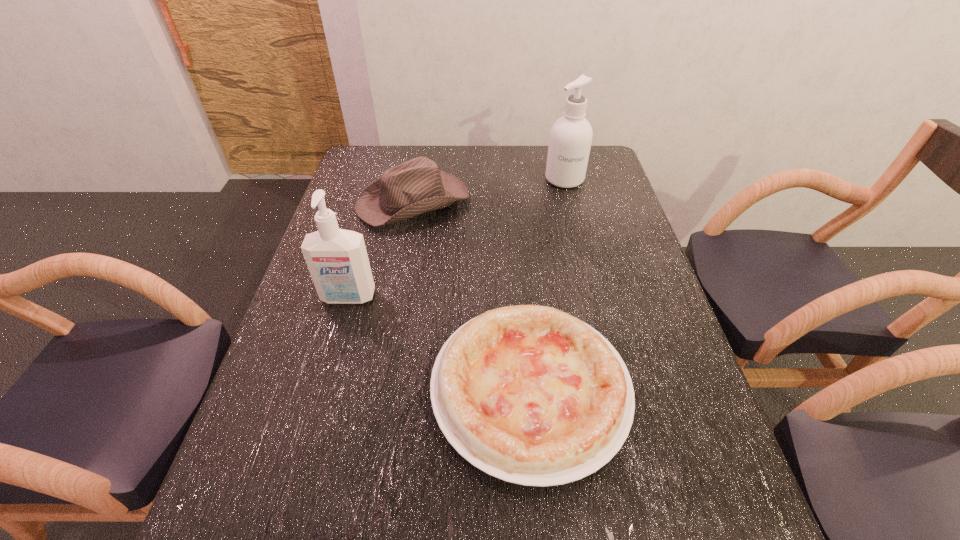
Locate an element on the screen. This screenshot has width=960, height=540. the farther cleansing agent is located at coordinates (571, 135).

Find the location of a particular element. Image resolution: width=960 pixels, height=540 pixels. the nearer cleansing agent is located at coordinates (337, 259).

Where is `the third farthest object`? the third farthest object is located at coordinates (337, 259).

Locate an element on the screen. fedora is located at coordinates (416, 186).

You are a GUI agent. You are given a task and a screenshot of the screen. Output one action in this format:
    pyautogui.click(x=<x>, y=<y>)
    Task: Click on the shortest object
    The image size is (960, 540).
    Given the screenshot: What is the action you would take?
    pyautogui.click(x=529, y=394)

The height and width of the screenshot is (540, 960). I want to click on pizza, so click(529, 394).

Where is `vacant space located on the front label of the farther cleansing agent`? The image size is (960, 540). vacant space located on the front label of the farther cleansing agent is located at coordinates (572, 208).

Find the location of a particular element. The image size is (960, 540). free space located on the front label of the left cleansing agent is located at coordinates (322, 391).

Where is `free space located on the back of the second shortest object`? This screenshot has height=540, width=960. free space located on the back of the second shortest object is located at coordinates (421, 155).

Where is `vacant space located 0.290m on the back of the pizza`? vacant space located 0.290m on the back of the pizza is located at coordinates [x=516, y=238].